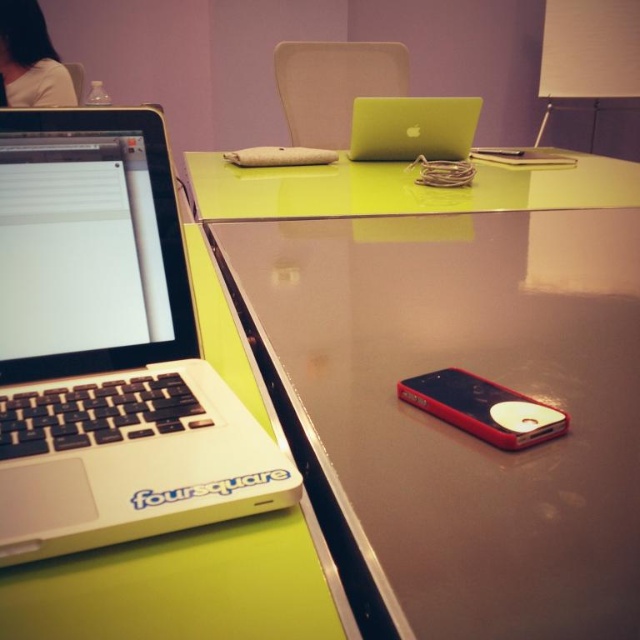
You are organizing the desk and need to place a new item between the matte white lampshade at upper right and the red plastic phone at lower right. Based on their current positions, which object should you place the item closer to if you want it to be nearer to the right edge of the desk?

The matte white lampshade at upper right is positioned on the right side of the red plastic phone at lower right. Therefore, placing the item closer to the matte white lampshade at upper right would make it nearer to the right edge of the desk.

You are a photographer setting up for a product shoot. You have a matte white lampshade at upper right and a camera. The camera is positioned to capture the scene on the desk. Given that the recommended distance between the lampshade and camera for optimal lighting is 10 feet, will the current setup work?

The matte white lampshade at upper right and camera are 11.31 feet apart from each other, which exceeds the recommended 10 feet distance. To achieve optimal lighting, the camera should be moved closer to the lampshade or the lampshade should be moved closer to the camera.